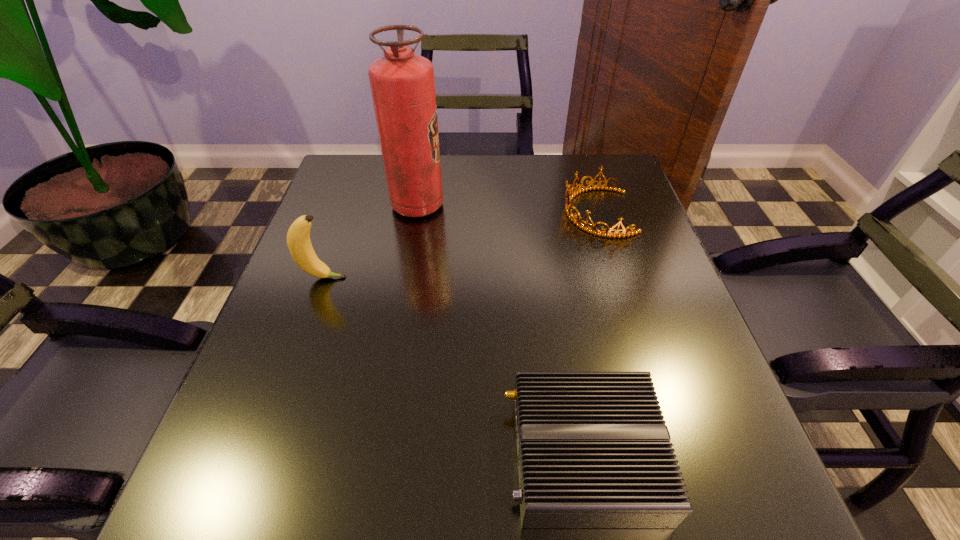
Locate an element on the screen. The width and height of the screenshot is (960, 540). vacant area located on the front-facing side of the tiara is located at coordinates (420, 212).

In order to click on vacant space located on the front-facing side of the tiara in this screenshot , I will do `click(405, 212)`.

Find the location of a particular element. vacant space situated on the back panel of the nearest object is located at coordinates (262, 455).

You are a GUI agent. You are given a task and a screenshot of the screen. Output one action in this format:
    pyautogui.click(x=<x>, y=<y>)
    Task: Click on the vacant space located on the back panel of the nearest object
    This screenshot has height=540, width=960.
    Given the screenshot: What is the action you would take?
    pyautogui.click(x=326, y=455)

At what (x,y) coordinates should I click in order to perform the action: click on free space located on the back panel of the nearest object. Please return your answer as a coordinate pair (x, y). The width and height of the screenshot is (960, 540). Looking at the image, I should click on (391, 455).

Where is `fire extinguisher located at the far edge`? The image size is (960, 540). fire extinguisher located at the far edge is located at coordinates (402, 83).

Identify the location of tiara present at the far edge. (593, 230).

Where is `object that is at the near edge`? This screenshot has height=540, width=960. object that is at the near edge is located at coordinates click(593, 449).

Locate an element on the screen. object present at the left edge is located at coordinates (298, 237).

You are a GUI agent. You are given a task and a screenshot of the screen. Output one action in this format:
    pyautogui.click(x=<x>, y=<y>)
    Task: Click on the tiara situated at the right edge
    The image size is (960, 540).
    Given the screenshot: What is the action you would take?
    pyautogui.click(x=593, y=230)